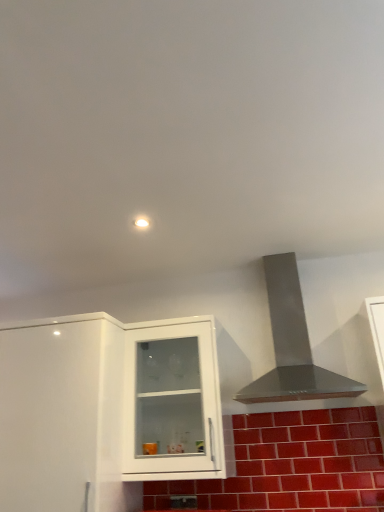
Question: Should I look upward or downward to see white glossy cabinet at center, positioned as the second cabinetry in left-to-right order?

Choices:
 (A) down
 (B) up

Answer: (A)

Question: Should I look upward or downward to see glossy ceramic brick at lower center?

Choices:
 (A) up
 (B) down

Answer: (B)

Question: Is stainless steel vent at upper right oriented away from glossy ceramic brick at lower center?

Choices:
 (A) no
 (B) yes

Answer: (A)

Question: Is stainless steel vent at upper right further to camera compared to glossy ceramic brick at lower center?

Choices:
 (A) no
 (B) yes

Answer: (A)

Question: Does stainless steel vent at upper right have a lesser height compared to glossy ceramic brick at lower center?

Choices:
 (A) no
 (B) yes

Answer: (A)

Question: Is stainless steel vent at upper right located outside glossy ceramic brick at lower center?

Choices:
 (A) yes
 (B) no

Answer: (A)

Question: Is stainless steel vent at upper right positioned far away from glossy ceramic brick at lower center?

Choices:
 (A) yes
 (B) no

Answer: (B)

Question: Could you tell me if stainless steel vent at upper right is facing glossy ceramic brick at lower center?

Choices:
 (A) yes
 (B) no

Answer: (B)

Question: From the image's perspective, would you say glossy ceramic brick at lower center is shown under stainless steel vent at upper right?

Choices:
 (A) no
 (B) yes

Answer: (B)

Question: From a real-world perspective, does glossy ceramic brick at lower center sit lower than stainless steel vent at upper right?

Choices:
 (A) no
 (B) yes

Answer: (B)

Question: Considering the relative sizes of glossy ceramic brick at lower center and stainless steel vent at upper right in the image provided, is glossy ceramic brick at lower center shorter than stainless steel vent at upper right?

Choices:
 (A) no
 (B) yes

Answer: (B)

Question: Is the depth of glossy ceramic brick at lower center greater than that of stainless steel vent at upper right?

Choices:
 (A) no
 (B) yes

Answer: (B)

Question: From the image's perspective, is glossy ceramic brick at lower center above stainless steel vent at upper right?

Choices:
 (A) no
 (B) yes

Answer: (A)

Question: Is stainless steel vent at upper right at the back of glossy ceramic brick at lower center?

Choices:
 (A) yes
 (B) no

Answer: (B)

Question: Does white glossy cabinet at center, positioned as the second cabinetry in left-to-right order, have a smaller size compared to glossy ceramic brick at lower center?

Choices:
 (A) yes
 (B) no

Answer: (B)